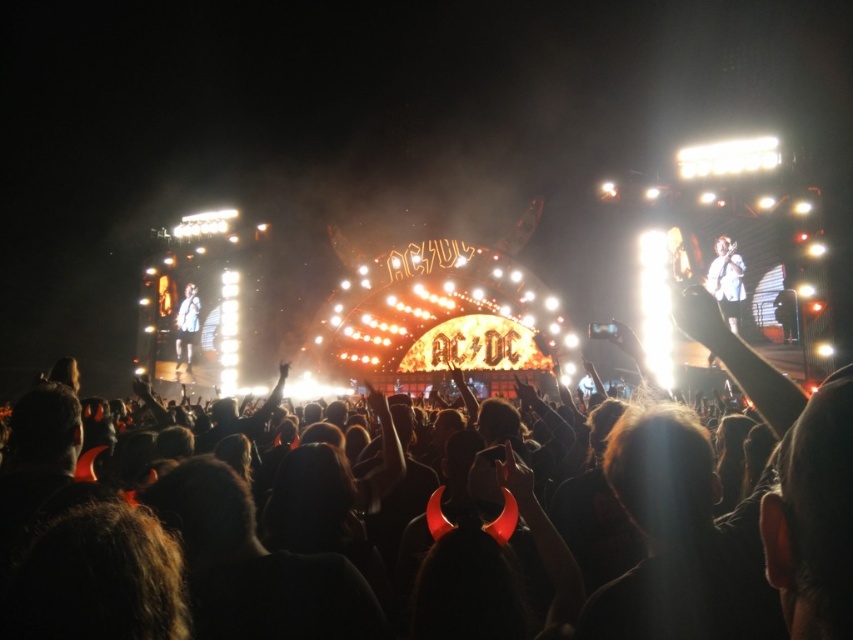
Question: Which point is closer to the camera?

Choices:
 (A) white fabric shirt at left
 (B) white fabric shirt at upper right

Answer: (B)

Question: Which point is closer to the camera?

Choices:
 (A) white fabric shirt at left
 (B) white fabric shirt at upper right

Answer: (B)

Question: Does white fabric shirt at upper right lie in front of white fabric shirt at left?

Choices:
 (A) yes
 (B) no

Answer: (A)

Question: Can you confirm if white fabric shirt at upper right is positioned to the right of white fabric shirt at left?

Choices:
 (A) no
 (B) yes

Answer: (B)

Question: Does white fabric shirt at upper right appear on the right side of white fabric shirt at left?

Choices:
 (A) no
 (B) yes

Answer: (B)